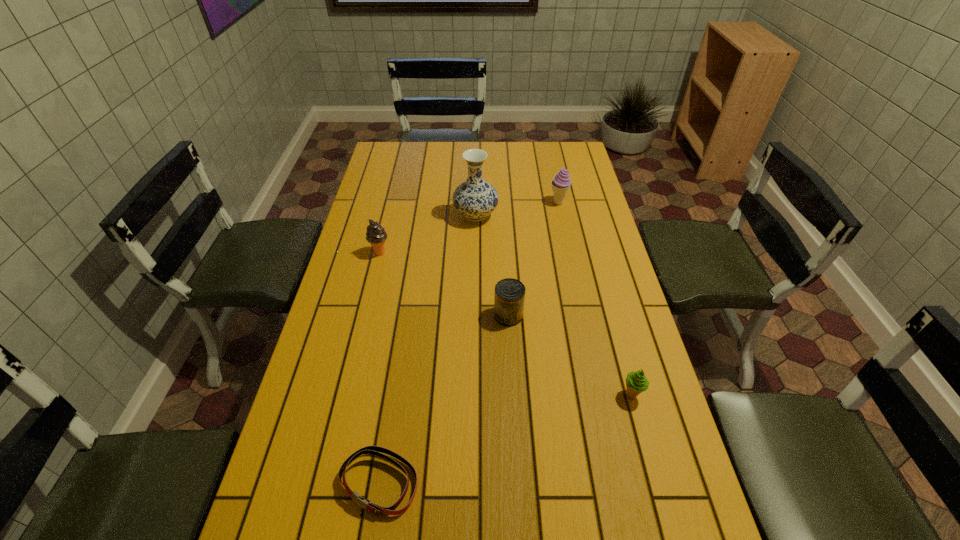
The width and height of the screenshot is (960, 540). I want to click on free space that is in between the second icecream from left to right and the tallest object, so click(x=517, y=209).

The width and height of the screenshot is (960, 540). Identify the location of empty space that is in between the tallest object and the second nearest icecream. (428, 234).

Find the location of a particular element. The height and width of the screenshot is (540, 960). object that is the fifth closest one to the can is located at coordinates (560, 185).

This screenshot has height=540, width=960. In order to click on object that is the fifth closest to the second icecream from left to right in this screenshot , I will do `click(375, 450)`.

The height and width of the screenshot is (540, 960). Find the location of `icecream that can be found as the closest to the leftmost icecream`. icecream that can be found as the closest to the leftmost icecream is located at coordinates (560, 185).

You are a GUI agent. You are given a task and a screenshot of the screen. Output one action in this format:
    pyautogui.click(x=<x>, y=<y>)
    Task: Click on the icecream that is the closest to the third nearest object
    This screenshot has height=540, width=960.
    Given the screenshot: What is the action you would take?
    pyautogui.click(x=636, y=382)

Image resolution: width=960 pixels, height=540 pixels. I want to click on free region that satisfies the following two spatial constraints: 1. on the front side of the second nearest icecream; 2. on the right side of the nearest icecream, so (x=346, y=395).

Locate an element on the screen. This screenshot has width=960, height=540. free space in the image that satisfies the following two spatial constraints: 1. on the front side of the fourth farthest object; 2. on the right side of the nearest icecream is located at coordinates (514, 395).

Where is `free space in the image that satisfies the following two spatial constraints: 1. on the front side of the nearest object; 2. on the right side of the fourth nearest object`? The image size is (960, 540). free space in the image that satisfies the following two spatial constraints: 1. on the front side of the nearest object; 2. on the right side of the fourth nearest object is located at coordinates (324, 482).

The height and width of the screenshot is (540, 960). I want to click on vacant position in the image that satisfies the following two spatial constraints: 1. on the front side of the can; 2. on the left side of the vase, so pyautogui.click(x=474, y=315).